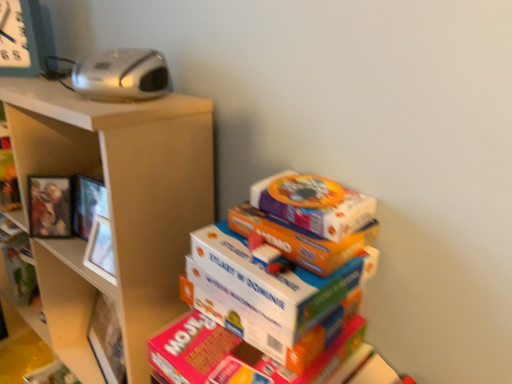
Question: Should I look upward or downward to see wooden photo frame at left?

Choices:
 (A) down
 (B) up

Answer: (A)

Question: Can you confirm if wooden photo frame at left is bigger than metallic gray clock at upper left?

Choices:
 (A) no
 (B) yes

Answer: (A)

Question: From a real-world perspective, is wooden photo frame at left located beneath metallic gray clock at upper left?

Choices:
 (A) yes
 (B) no

Answer: (A)

Question: Is wooden photo frame at left further to camera compared to metallic gray clock at upper left?

Choices:
 (A) no
 (B) yes

Answer: (A)

Question: Does wooden photo frame at left have a lesser width compared to metallic gray clock at upper left?

Choices:
 (A) yes
 (B) no

Answer: (B)

Question: Is the depth of wooden photo frame at left less than that of metallic gray clock at upper left?

Choices:
 (A) no
 (B) yes

Answer: (B)

Question: Can you confirm if wooden photo frame at left is taller than metallic gray clock at upper left?

Choices:
 (A) yes
 (B) no

Answer: (B)

Question: Considering the relative sizes of wooden photo frame at left and matte brown shelf at upper left, the 1th shelf ordered from the bottom, in the image provided, is wooden photo frame at left smaller than matte brown shelf at upper left, the 1th shelf ordered from the bottom,?

Choices:
 (A) no
 (B) yes

Answer: (B)

Question: From a real-world perspective, is wooden photo frame at left located higher than matte brown shelf at upper left, the 1th shelf ordered from the bottom?

Choices:
 (A) yes
 (B) no

Answer: (A)

Question: Is wooden photo frame at left aimed at matte brown shelf at upper left, arranged as the 2th shelf when viewed from the top?

Choices:
 (A) no
 (B) yes

Answer: (B)

Question: Considering the relative sizes of wooden photo frame at left and matte brown shelf at upper left, the 1th shelf ordered from the bottom, in the image provided, is wooden photo frame at left shorter than matte brown shelf at upper left, the 1th shelf ordered from the bottom,?

Choices:
 (A) yes
 (B) no

Answer: (A)

Question: From the image's perspective, is wooden photo frame at left under matte brown shelf at upper left, arranged as the 2th shelf when viewed from the top?

Choices:
 (A) yes
 (B) no

Answer: (B)

Question: Is matte brown shelf at upper left, the 1th shelf ordered from the bottom, located within wooden photo frame at left?

Choices:
 (A) no
 (B) yes

Answer: (A)

Question: Is wooden shelf at left, the first shelf when ordered from top to bottom, taller than matte brown shelf at upper left, the 1th shelf ordered from the bottom?

Choices:
 (A) no
 (B) yes

Answer: (A)